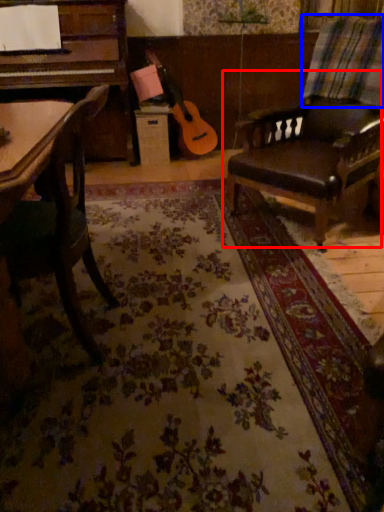
Question: Which object is further to the camera taking this photo, chair (highlighted by a red box) or plaid (highlighted by a blue box)?

Choices:
 (A) chair
 (B) plaid

Answer: (B)